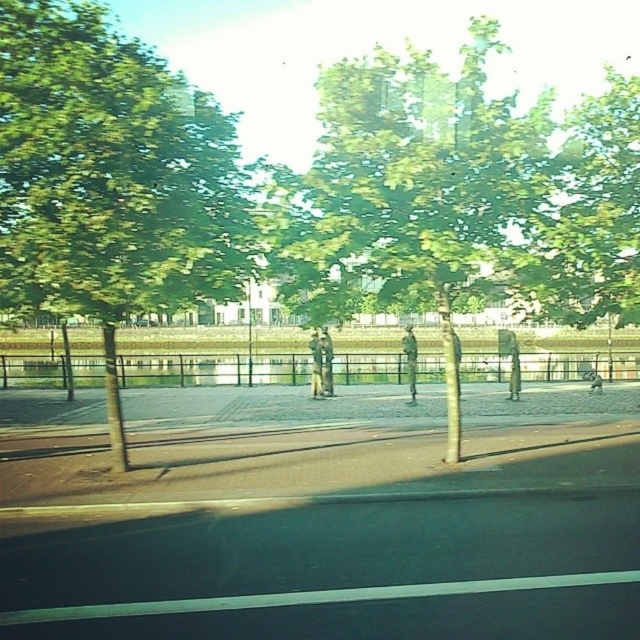
You are standing at the center of the paved pathway in the urban park. Which direction should you walk to reach the green leafy tree at upper left?

The green leafy tree at upper left is located at point coordinates, so you should walk towards the upper left direction to reach it.

You are a pedestrian standing on the paved pathway in the park. You see a green leafy tree at center and a matte gray statue at center. Which object is positioned to the right when facing the scene?

The green leafy tree at center is to the right of the matte gray statue at center.

You are standing at the point marked by the coordinates point at (x=109, y=179) in the image. Which object from the scene would you be closest to?

The point at (x=109, y=179) is on the green leafy tree at upper left, so you would be closest to the green leafy tree at upper left.